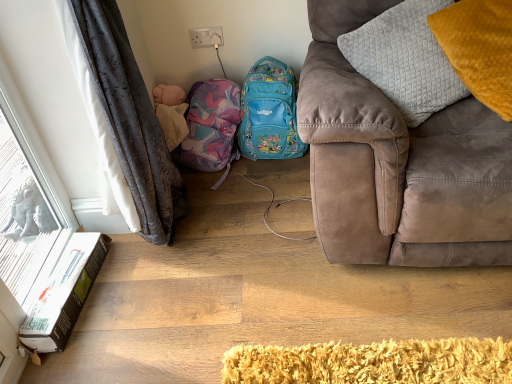
What do you see at coordinates (210, 126) in the screenshot? I see `matte purple backpack at center` at bounding box center [210, 126].

What is the approximate width of matte blue backpack at center?

matte blue backpack at center is 9.75 inches in width.

In order to face quilted gray pillow at upper right, the second pillow positioned from the right, should I rotate leftwards or rightwards?

A 20.483 degree turn to the right will do.

Find the location of a particular element. white frosted glass at left is located at coordinates (25, 210).

Where is `yellow velvet pillow at upper right, acting as the second pillow starting from the left`? This screenshot has height=384, width=512. yellow velvet pillow at upper right, acting as the second pillow starting from the left is located at coordinates (479, 49).

The width and height of the screenshot is (512, 384). What are the coordinates of `box in front of the matte purple backpack at center` in the screenshot? It's located at (64, 293).

How distant is matte purple backpack at center from white cardboard box at lower left?

matte purple backpack at center and white cardboard box at lower left are 71.22 centimeters apart from each other.

Is matte purple backpack at center to the left or to the right of white cardboard box at lower left in the image?

matte purple backpack at center is positioned on white cardboard box at lower left's right side.

Between matte purple backpack at center and white cardboard box at lower left, which one has larger width?

Wider between the two is white cardboard box at lower left.

Based on the photo, considering the sizes of yellow velvet pillow at upper right, acting as the second pillow starting from the left, and white frosted glass at left in the image, is yellow velvet pillow at upper right, acting as the second pillow starting from the left, wider or thinner than white frosted glass at left?

yellow velvet pillow at upper right, acting as the second pillow starting from the left, is wider than white frosted glass at left.

From a real-world perspective, is yellow velvet pillow at upper right, which is the first pillow in right-to-left order, over white frosted glass at left?

Yes.

From the image's perspective, is yellow velvet pillow at upper right, acting as the second pillow starting from the left, above or below white frosted glass at left?

yellow velvet pillow at upper right, acting as the second pillow starting from the left, is situated higher than white frosted glass at left in the image.

Between quilted gray pillow at upper right, the second pillow positioned from the right, and matte blue backpack at center, which one is positioned behind?

matte blue backpack at center is further from the camera.

Is quilted gray pillow at upper right, the first pillow positioned from the left, oriented away from matte blue backpack at center?

quilted gray pillow at upper right, the first pillow positioned from the left, does not have its back to matte blue backpack at center.

Which is more to the right, quilted gray pillow at upper right, the second pillow positioned from the right, or matte blue backpack at center?

quilted gray pillow at upper right, the second pillow positioned from the right.

I want to click on box beneath the white frosted glass at left (from a real-world perspective), so [x=64, y=293].

Is white frosted glass at left with white cardboard box at lower left?

white frosted glass at left and white cardboard box at lower left are clearly separated.

From a real-world perspective, who is located higher, white frosted glass at left or white cardboard box at lower left?

white frosted glass at left.

From the picture: Is white frosted glass at left inside or outside of white cardboard box at lower left?

white frosted glass at left is located beyond the bounds of white cardboard box at lower left.

From the image's perspective, is suede couch at right above or below matte blue backpack at center?

suede couch at right is above matte blue backpack at center.

Considering the positions of point (298, 124) and point (298, 143), is point (298, 124) closer or farther from the camera than point (298, 143)?

Point (298, 124) is closer to the camera than point (298, 143).

Looking at the image, does suede couch at right seem bigger or smaller compared to matte blue backpack at center?

Clearly, suede couch at right is larger in size than matte blue backpack at center.

Considering the sizes of objects matte blue backpack at center and quilted gray pillow at upper right, the second pillow positioned from the right, in the image provided, who is taller, matte blue backpack at center or quilted gray pillow at upper right, the second pillow positioned from the right,?

With more height is quilted gray pillow at upper right, the second pillow positioned from the right.

From a real-world perspective, is matte blue backpack at center below quilted gray pillow at upper right, the first pillow positioned from the left?

Yes.

Considering the relative positions of matte blue backpack at center and quilted gray pillow at upper right, the second pillow positioned from the right, in the image provided, is matte blue backpack at center in front of quilted gray pillow at upper right, the second pillow positioned from the right,?

No, the depth of matte blue backpack at center is greater than that of quilted gray pillow at upper right, the second pillow positioned from the right.

Considering the positions of objects quilted gray pillow at upper right, the first pillow positioned from the left, and white cardboard box at lower left in the image provided, who is more to the left, quilted gray pillow at upper right, the first pillow positioned from the left, or white cardboard box at lower left?

Positioned to the left is white cardboard box at lower left.

Does quilted gray pillow at upper right, the first pillow positioned from the left, come in front of white cardboard box at lower left?

Yes, it is.

From the image's perspective, which one is positioned lower, quilted gray pillow at upper right, the second pillow positioned from the right, or white cardboard box at lower left?

white cardboard box at lower left is shown below in the image.

In order to click on bag above the white cardboard box at lower left (from the image's perspective) in this screenshot , I will do `click(210, 126)`.

The width and height of the screenshot is (512, 384). I want to click on window below the yellow velvet pillow at upper right, acting as the second pillow starting from the left (from the image's perspective), so click(x=25, y=210).

From the image, which object appears to be nearer to white cardboard box at lower left, yellow velvet pillow at upper right, which is the first pillow in right-to-left order, or white frosted glass at left?

white frosted glass at left lies closer to white cardboard box at lower left than the other object.

Which object lies nearer to the anchor point white cardboard box at lower left, quilted gray pillow at upper right, the second pillow positioned from the right, or suede couch at right?

The object closer to white cardboard box at lower left is suede couch at right.

Based on their spatial positions, is quilted gray pillow at upper right, the second pillow positioned from the right, or matte purple backpack at center further from white cardboard box at lower left?

Based on the image, quilted gray pillow at upper right, the second pillow positioned from the right, appears to be further to white cardboard box at lower left.

When comparing their distances from yellow velvet pillow at upper right, acting as the second pillow starting from the left, does white cardboard box at lower left or quilted gray pillow at upper right, the first pillow positioned from the left, seem further?

white cardboard box at lower left is positioned further to the anchor yellow velvet pillow at upper right, acting as the second pillow starting from the left.

Based on their spatial positions, is quilted gray pillow at upper right, the second pillow positioned from the right, or yellow velvet pillow at upper right, acting as the second pillow starting from the left, further from suede couch at right?

yellow velvet pillow at upper right, acting as the second pillow starting from the left, lies further to suede couch at right than the other object.

From the image, which object appears to be nearer to white cardboard box at lower left, suede couch at right or white frosted glass at left?

white frosted glass at left lies closer to white cardboard box at lower left than the other object.

When comparing their distances from matte blue backpack at center, does suede couch at right or white frosted glass at left seem further?

The object further to matte blue backpack at center is white frosted glass at left.

Looking at the image, which one is located further to white cardboard box at lower left, quilted gray pillow at upper right, the second pillow positioned from the right, or matte blue backpack at center?

Based on the image, quilted gray pillow at upper right, the second pillow positioned from the right, appears to be further to white cardboard box at lower left.

Image resolution: width=512 pixels, height=384 pixels. Find the location of `backpack located between suede couch at right and matte purple backpack at center in the depth direction`. backpack located between suede couch at right and matte purple backpack at center in the depth direction is located at coordinates (269, 113).

Where is `backpack between matte purple backpack at center and yellow velvet pillow at upper right, acting as the second pillow starting from the left`? backpack between matte purple backpack at center and yellow velvet pillow at upper right, acting as the second pillow starting from the left is located at coordinates (269, 113).

In order to click on backpack situated between matte purple backpack at center and quilted gray pillow at upper right, the first pillow positioned from the left, from left to right in this screenshot , I will do `click(269, 113)`.

Where is `studio couch between matte purple backpack at center and yellow velvet pillow at upper right, which is the first pillow in right-to-left order`? The height and width of the screenshot is (384, 512). studio couch between matte purple backpack at center and yellow velvet pillow at upper right, which is the first pillow in right-to-left order is located at coordinates (398, 163).